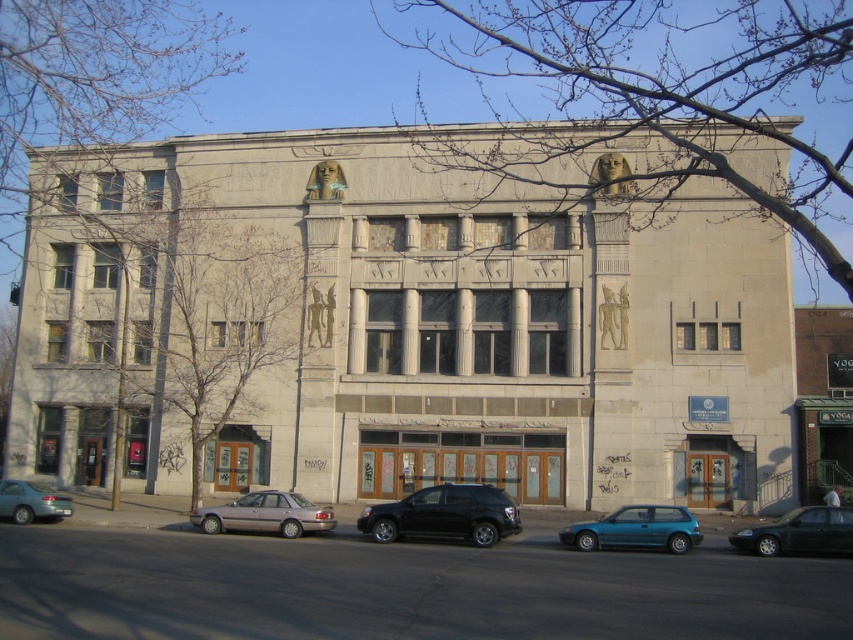
Based on the photo, does satin silver sedan at lower center have a smaller size compared to teal matte sedan at lower left?

Indeed, satin silver sedan at lower center has a smaller size compared to teal matte sedan at lower left.

Which is above, satin silver sedan at lower center or teal matte sedan at lower left?

satin silver sedan at lower center is higher up.

The image size is (853, 640). I want to click on satin silver sedan at lower center, so click(x=265, y=515).

Find the location of a particular element. This screenshot has height=640, width=853. satin silver sedan at lower center is located at coordinates (265, 515).

Locate an element on the screen. black matte suv at center is located at coordinates pos(444,515).

This screenshot has height=640, width=853. Find the location of `black matte suv at center`. black matte suv at center is located at coordinates (444, 515).

Does satin silver sedan at lower center have a greater height compared to green matte sedan at lower right?

Incorrect, satin silver sedan at lower center's height is not larger of green matte sedan at lower right's.

Can you confirm if satin silver sedan at lower center is positioned to the right of green matte sedan at lower right?

In fact, satin silver sedan at lower center is to the left of green matte sedan at lower right.

The image size is (853, 640). Identify the location of satin silver sedan at lower center. (265, 515).